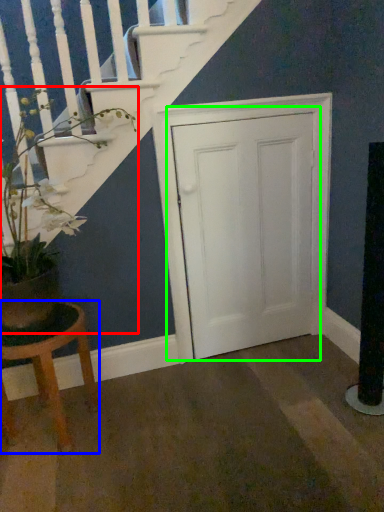
Question: Estimate the real-world distances between objects in this image. Which object is farther from houseplant (highlighted by a red box), stool (highlighted by a blue box) or door (highlighted by a green box)?

Choices:
 (A) stool
 (B) door

Answer: (B)